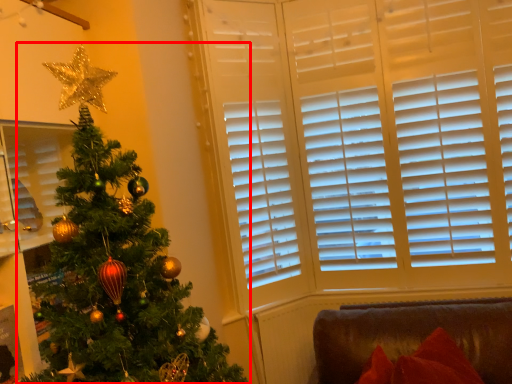
Question: From the image's perspective, what is the correct spatial positioning of christmas tree (annotated by the red box) in reference to furniture?

Choices:
 (A) below
 (B) above

Answer: (B)